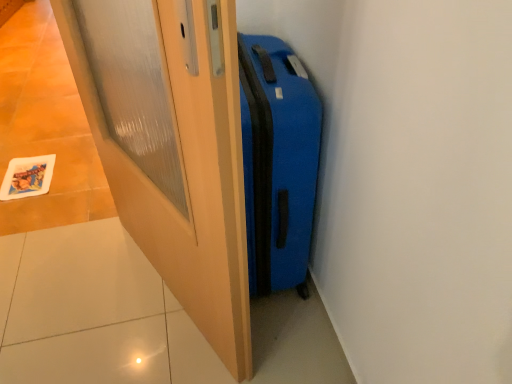
Locate an element on the screen. vacant space underneath matte wood door at center (from a real-world perspective) is located at coordinates pos(166,296).